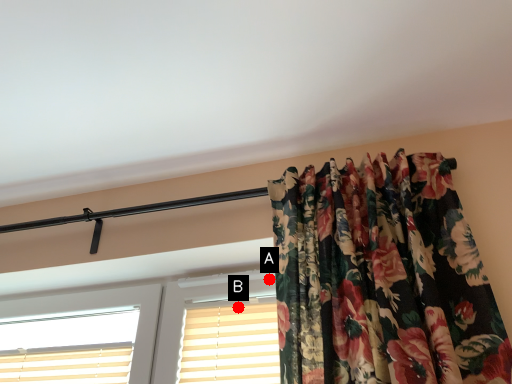
Question: Two points are circled on the image, labeled by A and B beside each circle. Among these points, which one is nearest to the camera?

Choices:
 (A) A is closer
 (B) B is closer

Answer: (A)